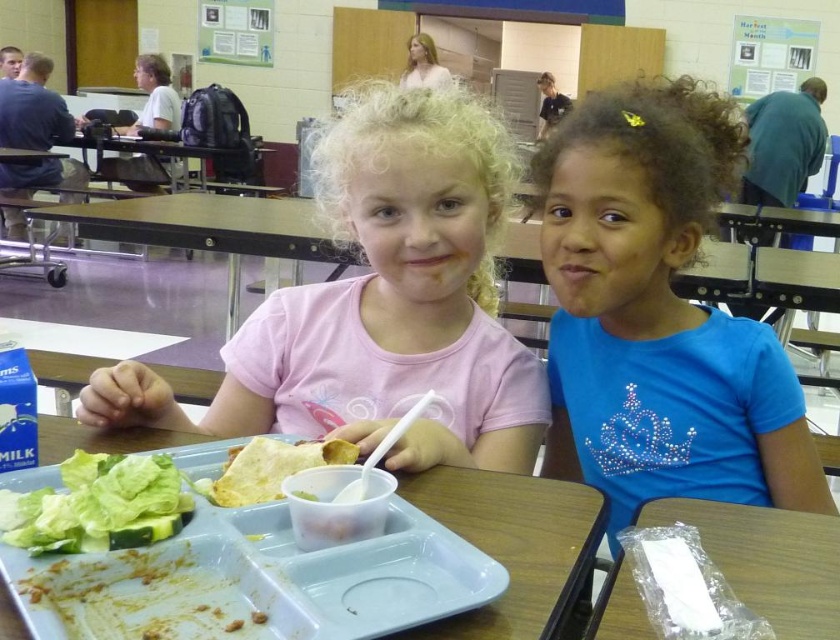
Question: Does blue sparkly shirt at upper right have a greater width compared to white plastic tray at center?

Choices:
 (A) no
 (B) yes

Answer: (B)

Question: Which object is positioned closest to the clear plastic bag at lower right?

Choices:
 (A) blue sparkly shirt at upper right
 (B) yellowish tortilla at center
 (C) white plastic tray at center

Answer: (C)

Question: Does blue sparkly shirt at upper right appear under yellowish tortilla at center?

Choices:
 (A) yes
 (B) no

Answer: (B)

Question: Which point is closer to the camera?

Choices:
 (A) (802, 637)
 (B) (361, 291)
 (C) (542, 145)
 (D) (458, 624)

Answer: (D)

Question: Which of the following is the farthest from the observer?

Choices:
 (A) blue sparkly shirt at upper right
 (B) matte pink shirt at center
 (C) clear plastic bag at lower right
 (D) yellowish tortilla at center

Answer: (B)

Question: Is blue sparkly shirt at upper right bigger than green leafy lettuce at lower left?

Choices:
 (A) no
 (B) yes

Answer: (B)